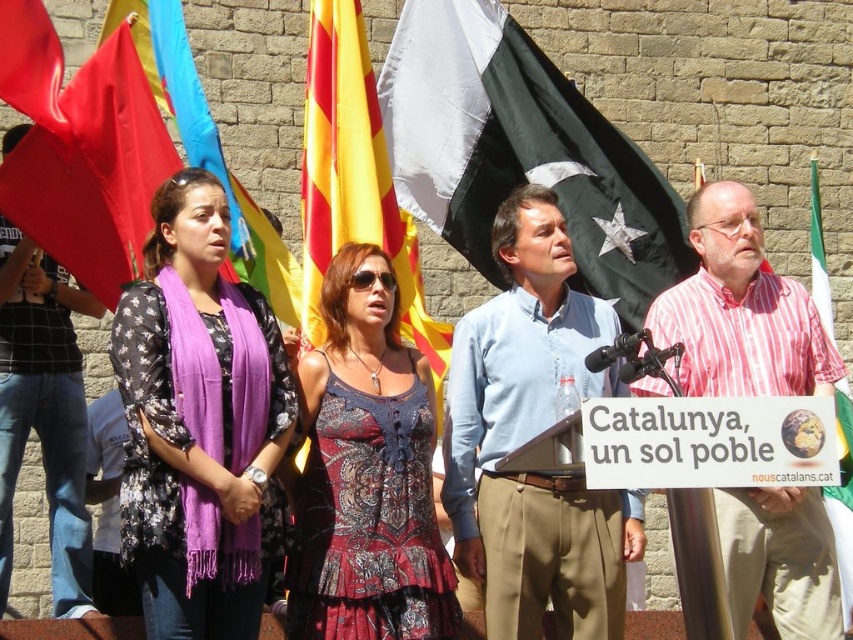
Question: Does white paper sign at center come in front of black printed t-shirt at left?

Choices:
 (A) no
 (B) yes

Answer: (B)

Question: Which is nearer to the yellowmaterial/textureflag at upper center?

Choices:
 (A) printed fabric dress at center
 (B) brushed metal water at bottle left
 (C) matte red flag at left
 (D) shiny red flag at upper left

Answer: (A)

Question: Estimate the real-world distances between objects in this image. Which object is farther from the white paper sign at center?

Choices:
 (A) printed fabric dress at center
 (B) purple scarf at left
 (C) red fabric flag at upper left
 (D) light blue shirt at center

Answer: (C)

Question: In this image, where is purple scarf at center located relative to white paper sign at center?

Choices:
 (A) above
 (B) below

Answer: (A)

Question: Can you confirm if white paper sign at center is bigger than black printed t-shirt at left?

Choices:
 (A) yes
 (B) no

Answer: (A)

Question: Which object appears closest to the camera in this image?

Choices:
 (A) white paper sign at center
 (B) red fabric flag at upper left
 (C) matte red flag at left

Answer: (A)